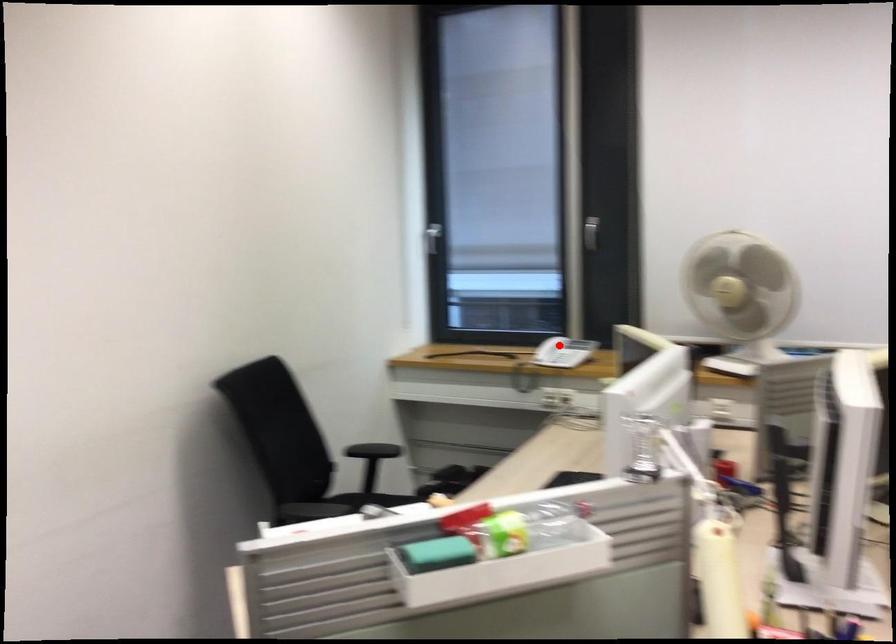
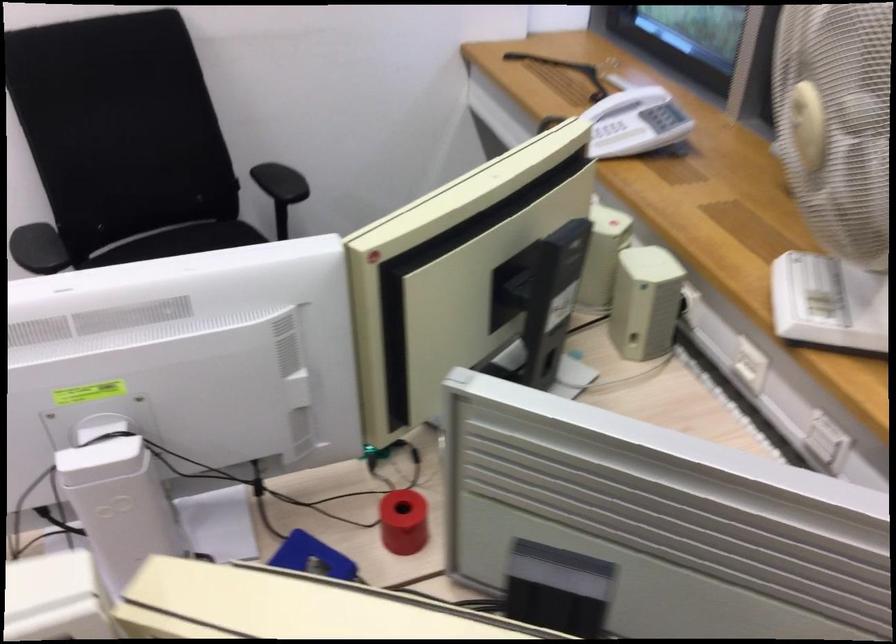
Where in the second image is the point corresponding to the highlighted location from the first image?

(617, 138)